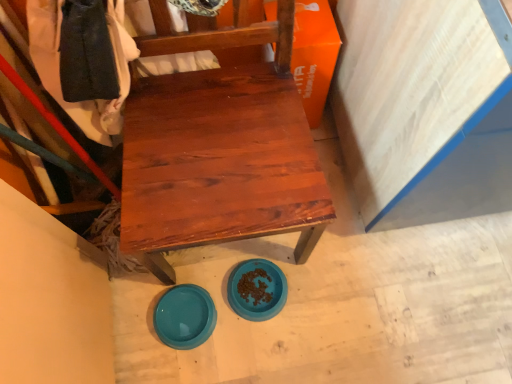
What are the coordinates of `empty space that is to the right of teal glossy plate at lower center, which is the second plate in right-to-left order` in the screenshot? It's located at (248, 339).